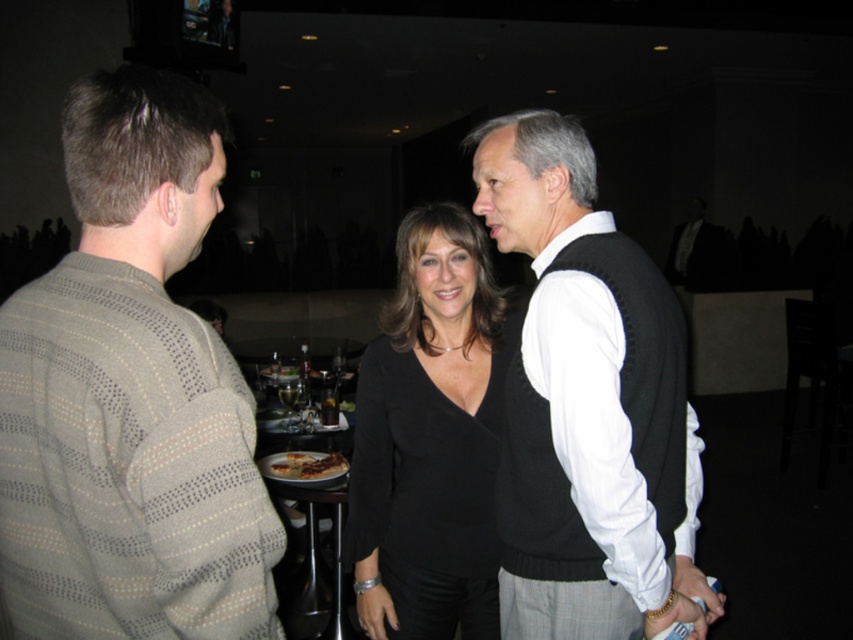
You are a photographer adjusting camera settings to focus on the two people at the center of the image. The black knit vest at center and the black matte top at center are both in your frame. Which clothing item appears shorter in height?

The black knit vest at center is not as tall as the black matte top at center, so the black knit vest at center appears shorter in height.

You are a photographer setting up for an event. You need to position a camera stand that requires at least 1.2 meters of vertical space. Looking at the image, will the space between the black matte top at center and the wooden table at center allow the stand to fit vertically?

The black matte top at center is taller than the wooden table at center. However, the vertical space between them isn not specified in the description. Without knowing the exact height difference, it is impossible to determine if the camera stand will fit.